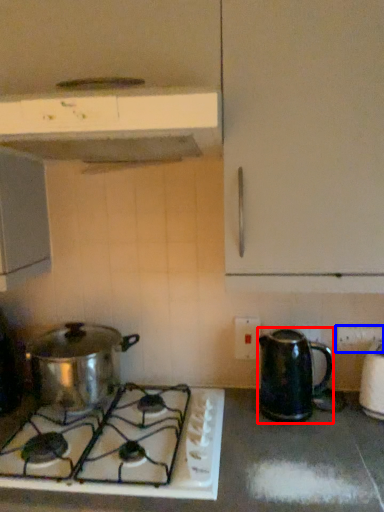
Question: Which of the following is the closest to the observer, kitchen appliance (highlighted by a red box) or electric outlet (highlighted by a blue box)?

Choices:
 (A) kitchen appliance
 (B) electric outlet

Answer: (A)